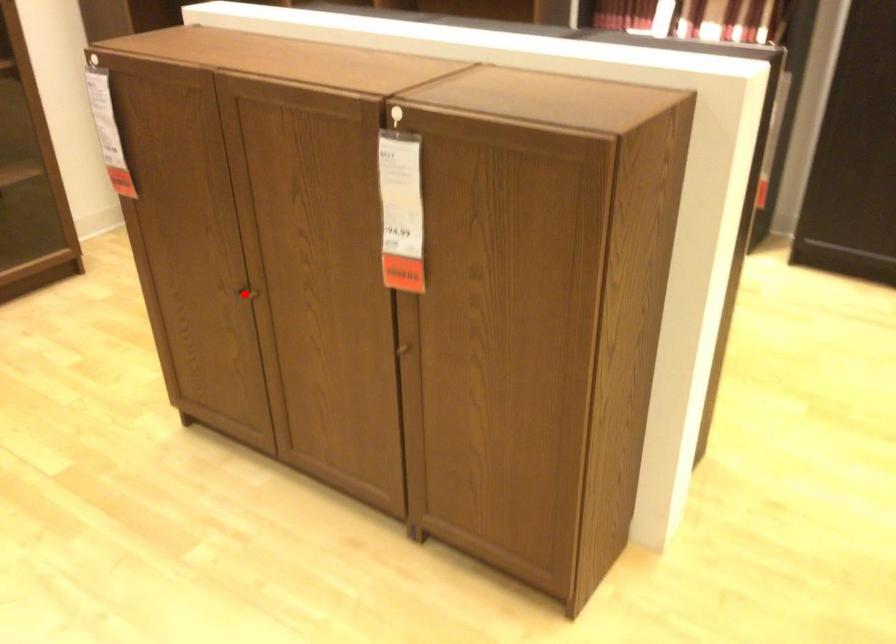
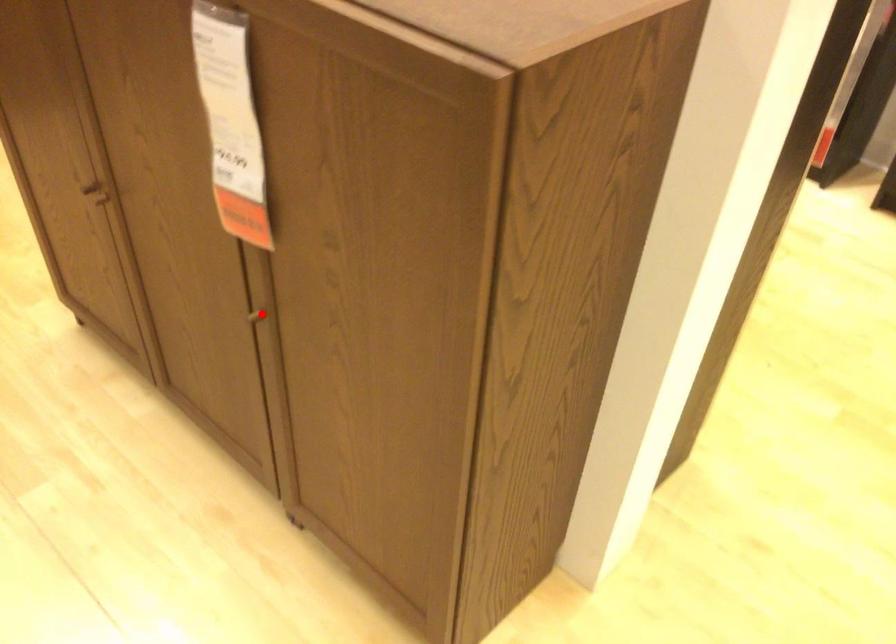
I am providing you with two images of the same scene from different viewpoints. A red point is marked on the first image and another point is marked on the second image. Do the highlighted points in image1 and image2 indicate the same real-world spot?

No